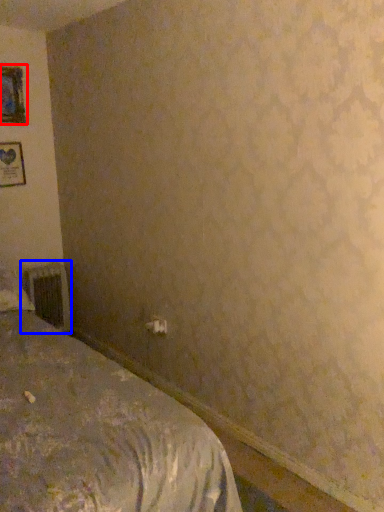
Question: Which object is further to the camera taking this photo, picture frame (highlighted by a red box) or radiator (highlighted by a blue box)?

Choices:
 (A) picture frame
 (B) radiator

Answer: (B)